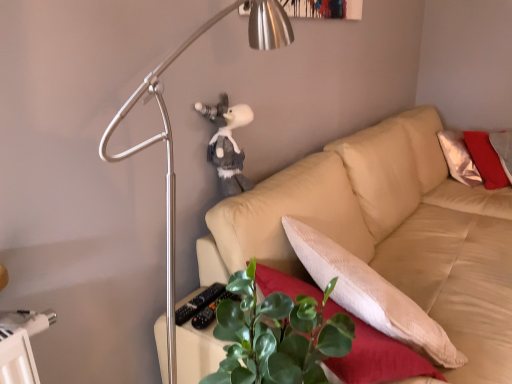
Question: Is beige fabric couch at center behind metallic silver lamp at upper left?

Choices:
 (A) no
 (B) yes

Answer: (B)

Question: Does beige fabric couch at center have a larger size compared to metallic silver lamp at upper left?

Choices:
 (A) yes
 (B) no

Answer: (A)

Question: Is beige fabric couch at center positioned far away from metallic silver lamp at upper left?

Choices:
 (A) yes
 (B) no

Answer: (B)

Question: From the image's perspective, is beige fabric couch at center over metallic silver lamp at upper left?

Choices:
 (A) no
 (B) yes

Answer: (A)

Question: From the image's perspective, would you say beige fabric couch at center is shown under metallic silver lamp at upper left?

Choices:
 (A) yes
 (B) no

Answer: (A)

Question: From a real-world perspective, relative to beige fabric couch at center, is green leafy plant at lower center vertically above or below?

Choices:
 (A) above
 (B) below

Answer: (A)

Question: Considering the positions of green leafy plant at lower center and beige fabric couch at center in the image, is green leafy plant at lower center bigger or smaller than beige fabric couch at center?

Choices:
 (A) big
 (B) small

Answer: (B)

Question: Does point (230, 344) appear closer or farther from the camera than point (390, 246)?

Choices:
 (A) closer
 (B) farther

Answer: (A)

Question: Considering their positions, is green leafy plant at lower center located in front of or behind beige fabric couch at center?

Choices:
 (A) front
 (B) behind

Answer: (A)

Question: Looking at the image, does metallic silver lamp at upper left seem bigger or smaller compared to beige fabric couch at center?

Choices:
 (A) big
 (B) small

Answer: (B)

Question: Is metallic silver lamp at upper left situated inside beige fabric couch at center or outside?

Choices:
 (A) inside
 (B) outside

Answer: (B)

Question: From the image's perspective, is metallic silver lamp at upper left positioned above or below beige fabric couch at center?

Choices:
 (A) above
 (B) below

Answer: (A)

Question: In terms of width, does metallic silver lamp at upper left look wider or thinner when compared to beige fabric couch at center?

Choices:
 (A) wide
 (B) thin

Answer: (B)

Question: Considering the relative positions of green leafy plant at lower center and metallic silver lamp at upper left in the image provided, is green leafy plant at lower center to the left or to the right of metallic silver lamp at upper left?

Choices:
 (A) right
 (B) left

Answer: (A)

Question: Is green leafy plant at lower center bigger or smaller than metallic silver lamp at upper left?

Choices:
 (A) big
 (B) small

Answer: (B)